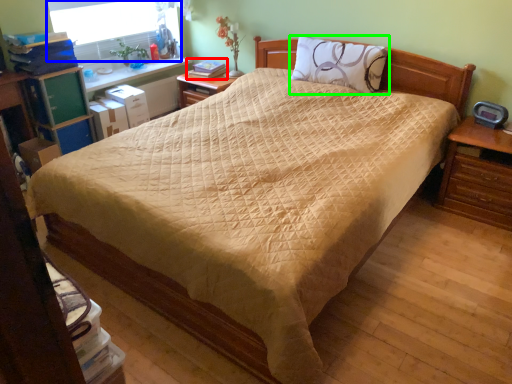
Question: Which object is positioned farthest from book (highlighted by a red box)? Select from window screen (highlighted by a blue box) and pillow (highlighted by a green box).

Choices:
 (A) window screen
 (B) pillow

Answer: (B)